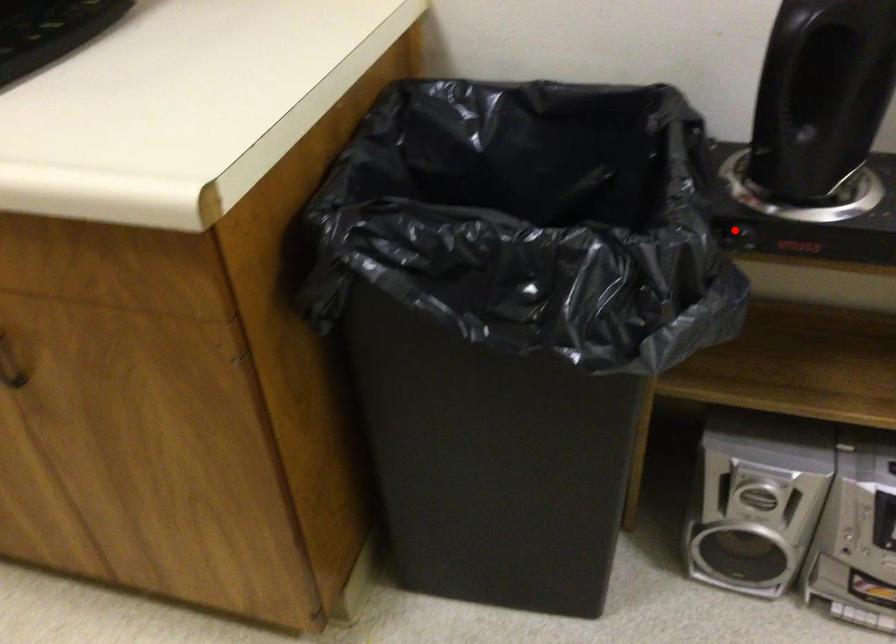
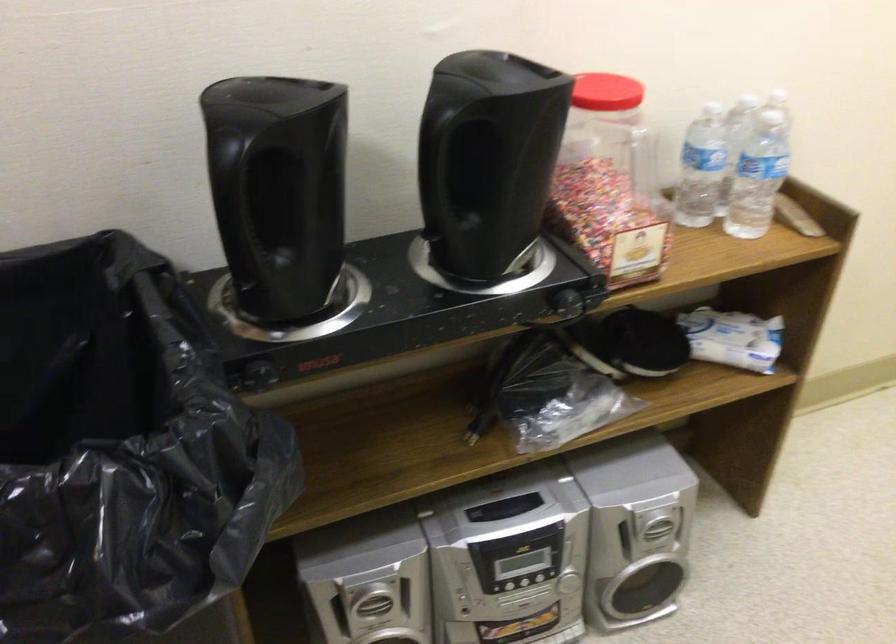
Question: I am providing you with two images of the same scene from different viewpoints. Image1 has a red point marked. In image2, the corresponding 3D location appears at what relative position? Reply with the corresponding letter.

Choices:
 (A) Closer
 (B) Farther

Answer: (A)